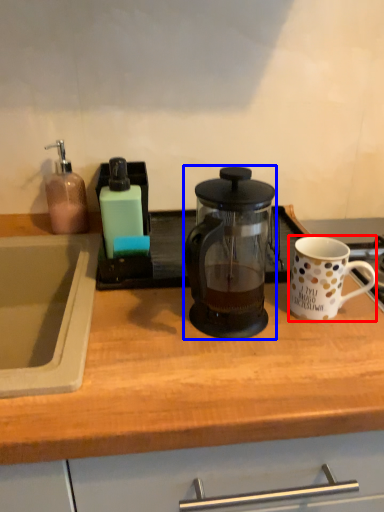
Question: Among these objects, which one is farthest to the camera, coffee cup (highlighted by a red box) or kettle (highlighted by a blue box)?

Choices:
 (A) coffee cup
 (B) kettle

Answer: (A)